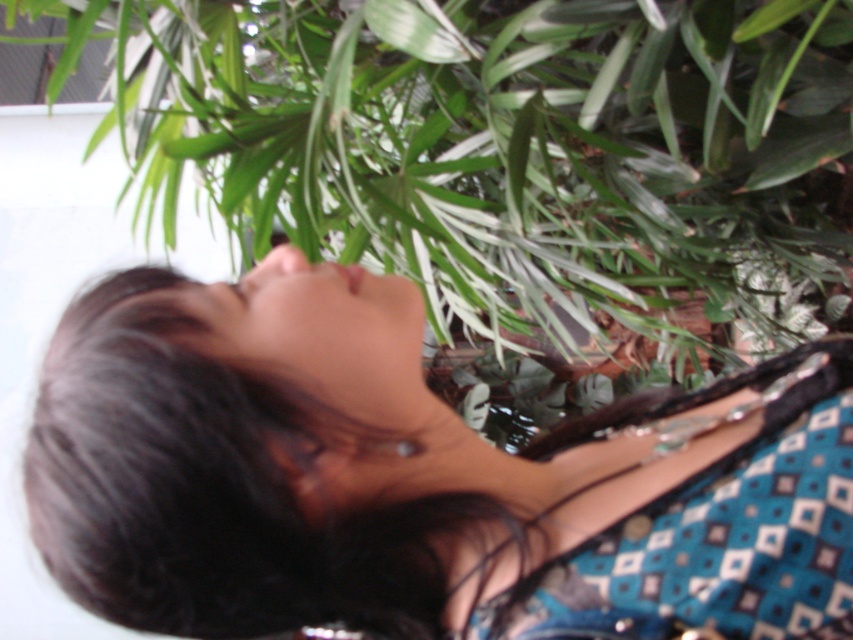
You are a photographer trying to capture a candid shot of the blue printed dress at center and the green leafy plant at upper center. If you want to ensure both subjects are in focus, what should you consider about their distance?

The blue printed dress at center is 29.77 inches from the green leafy plant at upper center. To ensure both are in focus, adjust the camera settings to account for this distance between them.

You are a photographer setting up a shoot. You notice the blue printed dress at center and the green leafy plant at upper center in the frame. Which object takes up more visual space in the composition?

The green leafy plant at upper center takes up more visual space than the blue printed dress at center in the composition.

You are a photographer setting up for a shoot. You want to capture the blue printed dress at center clearly. The camera is focused at 16 inches. Should you adjust the focus to ensure the dress is in focus?

The blue printed dress at center is 16.25 inches from the camera, which is slightly beyond the current focus distance of 16 inches. To ensure the dress is in focus, you should adjust the focus to 16.25 inches.